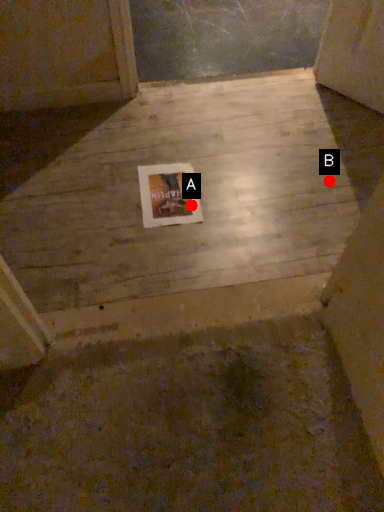
Question: Two points are circled on the image, labeled by A and B beside each circle. Which point appears closest to the camera in this image?

Choices:
 (A) A is closer
 (B) B is closer

Answer: (A)